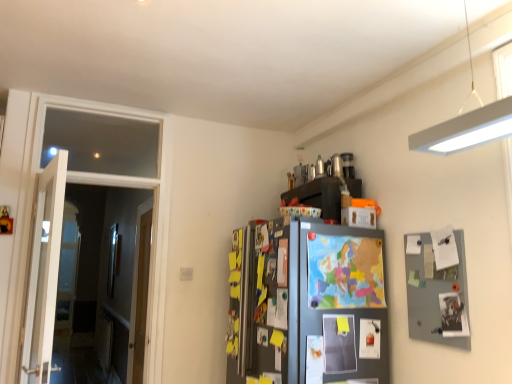
The image size is (512, 384). I want to click on colorful paper map at center, so click(345, 272).

In order to face wooden door at left, which ranks as the second door in front-to-back order, should I rotate leftwards or rightwards?

Turn left approximately 14.973 degrees to face it.

What is the approximate width of clear glass door at left?

It is 2.56 inches.

The image size is (512, 384). Identify the location of colorful paper map at center. (345, 272).

Who is smaller, matte black cabinet at upper right or wooden door at left, which is counted as the 1th door, starting from the back?

matte black cabinet at upper right is smaller.

Does matte black cabinet at upper right have a lesser width compared to wooden door at left, which ranks as the second door in front-to-back order?

No, matte black cabinet at upper right is not thinner than wooden door at left, which ranks as the second door in front-to-back order.

Measure the distance from matte black cabinet at upper right to wooden door at left, which ranks as the second door in front-to-back order.

matte black cabinet at upper right is 1.87 meters from wooden door at left, which ranks as the second door in front-to-back order.

Is point (312, 187) less distant than point (137, 236)?

Yes, point (312, 187) is closer to viewer.

How far apart are wooden door at left, which is counted as the 1th door, starting from the back, and clear glass door at left?

wooden door at left, which is counted as the 1th door, starting from the back, is 4.23 feet from clear glass door at left.

Is the position of wooden door at left, which is counted as the 1th door, starting from the back, less distant than that of clear glass door at left?

No, wooden door at left, which is counted as the 1th door, starting from the back, is behind clear glass door at left.

Would you say wooden door at left, which ranks as the second door in front-to-back order, is outside clear glass door at left?

wooden door at left, which ranks as the second door in front-to-back order, is positioned outside clear glass door at left.

Is wooden door at left, which is counted as the 1th door, starting from the back, positioned beyond the bounds of white wooden door at left, positioned as the second door in back-to-front order?

Yes, wooden door at left, which is counted as the 1th door, starting from the back, is outside of white wooden door at left, positioned as the second door in back-to-front order.

From a real-world perspective, which is physically below, wooden door at left, which ranks as the second door in front-to-back order, or white wooden door at left, positioned as the second door in back-to-front order?

wooden door at left, which ranks as the second door in front-to-back order, from a real-world perspective.

Is wooden door at left, which is counted as the 1th door, starting from the back, far from white wooden door at left, the 1th door viewed from the front?

That's right, there is a large distance between wooden door at left, which is counted as the 1th door, starting from the back, and white wooden door at left, the 1th door viewed from the front.

What's the angular difference between matte black cabinet at upper right and colorful paper map at center's facing directions?

The facing directions of matte black cabinet at upper right and colorful paper map at center are 3.69 degrees apart.

Is matte black cabinet at upper right closer to camera compared to colorful paper map at center?

No.

Identify the location of cabinetry located above the colorful paper map at center (from the image's perspective). (318, 196).

Does point (328, 184) lie in front of point (361, 275)?

No.

Between matte black cabinet at upper right and clear glass door at left, which one has smaller size?

Smaller between the two is matte black cabinet at upper right.

What are the coordinates of `cabinetry that appears behind the clear glass door at left` in the screenshot? It's located at (318, 196).

How different are the orientations of matte black cabinet at upper right and clear glass door at left in degrees?

There is a 3.3-degree angle between the facing directions of matte black cabinet at upper right and clear glass door at left.

Between matte black cabinet at upper right and clear glass door at left, which one appears on the right side from the viewer's perspective?

matte black cabinet at upper right is more to the right.

From a real-world perspective, who is located higher, clear glass door at left or matte black cabinet at upper right?

matte black cabinet at upper right, from a real-world perspective.

Consider the image. Which is farther, (80, 328) or (330, 185)?

The point (80, 328) is farther.

Which object is further away from the camera taking this photo, clear glass door at left or matte black cabinet at upper right?

matte black cabinet at upper right is further away from the camera.

Is clear glass door at left facing towards matte black cabinet at upper right?

No, clear glass door at left is not oriented towards matte black cabinet at upper right.

At what (x,y) coordinates should I click in order to perform the action: click on cabinetry above the colorful paper map at center (from a real-world perspective). Please return your answer as a coordinate pair (x, y). The height and width of the screenshot is (384, 512). Looking at the image, I should click on (318, 196).

From the image's perspective, which one is positioned higher, colorful paper map at center or matte black cabinet at upper right?

matte black cabinet at upper right.

Does point (321, 242) lie behind point (309, 202)?

No, (321, 242) is in front of (309, 202).

From a real-world perspective, is colorful paper map at center positioned above or below matte black cabinet at upper right?

From a real-world perspective, colorful paper map at center is physically below matte black cabinet at upper right.

Image resolution: width=512 pixels, height=384 pixels. Identify the location of cabinetry that appears above the wooden door at left, which is counted as the 1th door, starting from the back (from the image's perspective). pyautogui.click(x=318, y=196).

This screenshot has width=512, height=384. Identify the location of door on the right of the clear glass door at left. (140, 294).

Estimate the real-world distances between objects in this image. Which object is further from white wooden door at left, positioned as the second door in back-to-front order, clear glass door at left or colorful paper map at center?

clear glass door at left.

Estimate the real-world distances between objects in this image. Which object is further from colorful paper map at center, wooden door at left, which ranks as the second door in front-to-back order, or clear glass door at left?

clear glass door at left lies further to colorful paper map at center than the other object.

When comparing their distances from colorful paper map at center, does clear glass door at left or wooden door at left, which ranks as the second door in front-to-back order, seem closer?

wooden door at left, which ranks as the second door in front-to-back order, is closer to colorful paper map at center.

Looking at the image, which one is located closer to matte black cabinet at upper right, wooden door at left, which is counted as the 1th door, starting from the back, or colorful paper map at center?

colorful paper map at center is positioned closer to the anchor matte black cabinet at upper right.

Looking at this image, when comparing their distances from clear glass door at left, does colorful paper map at center or wooden door at left, which is counted as the 1th door, starting from the back, seem closer?

Based on the image, wooden door at left, which is counted as the 1th door, starting from the back, appears to be nearer to clear glass door at left.

From the image, which object appears to be farther from colorful paper map at center, matte black cabinet at upper right or clear glass door at left?

Based on the image, clear glass door at left appears to be further to colorful paper map at center.

From the picture: When comparing their distances from wooden door at left, which ranks as the second door in front-to-back order, does clear glass door at left or matte black cabinet at upper right seem closer?

clear glass door at left.

Which object lies further to the anchor point wooden door at left, which is counted as the 1th door, starting from the back, colorful paper map at center or clear glass door at left?

The object further to wooden door at left, which is counted as the 1th door, starting from the back, is colorful paper map at center.

The width and height of the screenshot is (512, 384). I want to click on glass door situated between white wooden door at left, positioned as the second door in back-to-front order, and colorful paper map at center from left to right, so point(100,283).

At what (x,y) coordinates should I click in order to perform the action: click on door between white wooden door at left, the 1th door viewed from the front, and colorful paper map at center. Please return your answer as a coordinate pair (x, y). The width and height of the screenshot is (512, 384). Looking at the image, I should click on (140, 294).

This screenshot has width=512, height=384. I want to click on door situated between white wooden door at left, positioned as the second door in back-to-front order, and matte black cabinet at upper right from left to right, so tap(140, 294).

Image resolution: width=512 pixels, height=384 pixels. What are the coordinates of `cabinetry between white wooden door at left, positioned as the second door in back-to-front order, and colorful paper map at center from left to right` in the screenshot? It's located at (318, 196).